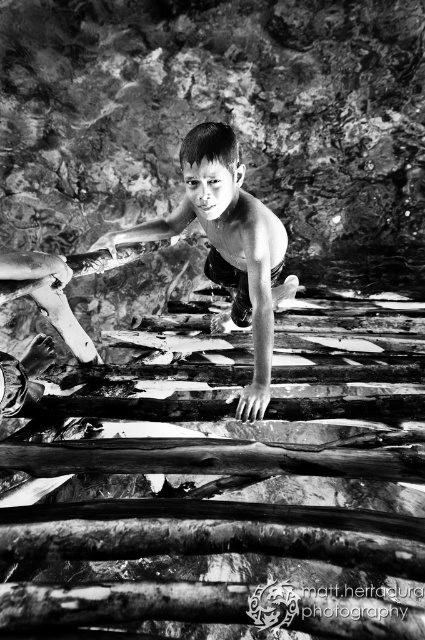
You are standing at the origin point in the image. Where is the rough wooden plank at center located in terms of coordinates?

The rough wooden plank at center is located at coordinates point (226, 499).

You are a safety inspector assessing the scene. The rough wooden plank at center and the smooth skin child at center are in a potentially dangerous setup. Which object is located to the right of the child?

The rough wooden plank at center is positioned on the right side of smooth skin child at center, so the rough wooden plank at center is to the right of the child.